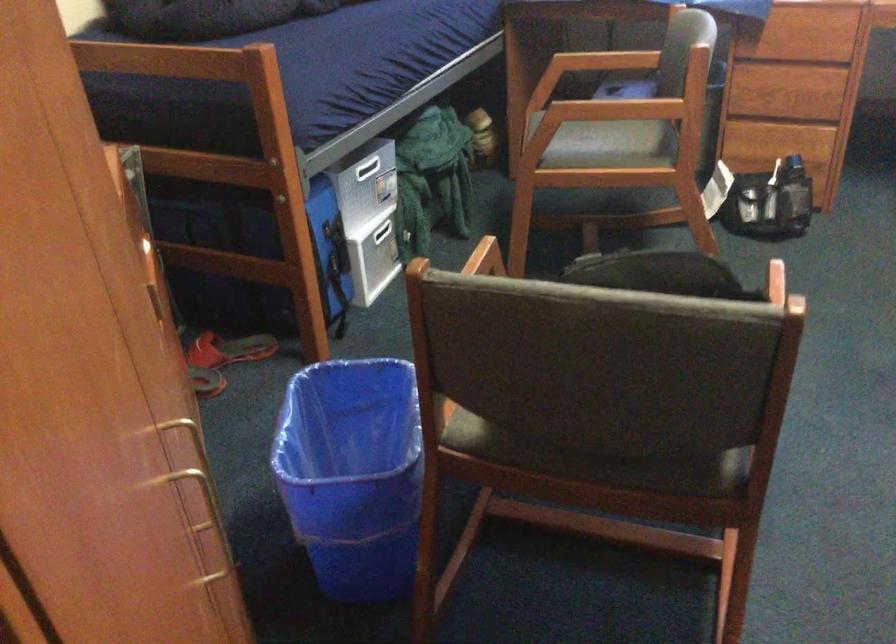
At what (x,y) coordinates should I click in order to perform the action: click on black bag. Please return your answer as a coordinate pair (x, y). Looking at the image, I should click on (659, 272).